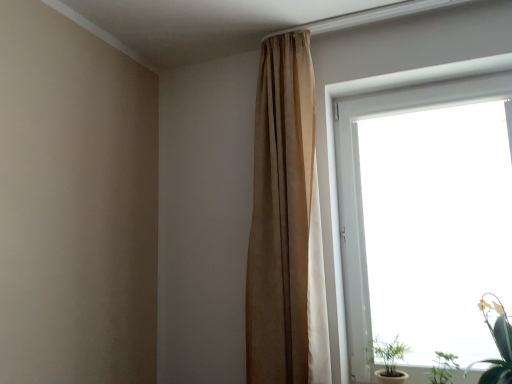
Question: Can you confirm if green leafy plant at lower right, the 2th houseplant when ordered from left to right, is bigger than green leafy plant at lower right, which is counted as the 3th houseplant, starting from the left?

Choices:
 (A) yes
 (B) no

Answer: (B)

Question: Is green leafy plant at lower right, the 2th houseplant when ordered from left to right, positioned far away from green leafy plant at lower right, which is counted as the 3th houseplant, starting from the left?

Choices:
 (A) no
 (B) yes

Answer: (A)

Question: Does green leafy plant at lower right, the 2th houseplant when ordered from left to right, have a lesser width compared to green leafy plant at lower right, which ranks as the first houseplant in right-to-left order?

Choices:
 (A) no
 (B) yes

Answer: (B)

Question: Is green leafy plant at lower right, the 2th houseplant when ordered from left to right, to the left of green leafy plant at lower right, which is counted as the 3th houseplant, starting from the left, from the viewer's perspective?

Choices:
 (A) no
 (B) yes

Answer: (B)

Question: Does green leafy plant at lower right, the 2th houseplant when ordered from left to right, have a lesser height compared to green leafy plant at lower right, which ranks as the first houseplant in right-to-left order?

Choices:
 (A) yes
 (B) no

Answer: (A)

Question: Based on their sizes in the image, would you say beige fabric curtain at upper center is bigger or smaller than green leafy plant at lower right, the 2th houseplant when ordered from left to right?

Choices:
 (A) small
 (B) big

Answer: (B)

Question: From their relative heights in the image, would you say beige fabric curtain at upper center is taller or shorter than green leafy plant at lower right, the 2th houseplant when ordered from left to right?

Choices:
 (A) short
 (B) tall

Answer: (B)

Question: From the image's perspective, is beige fabric curtain at upper center located above or below green leafy plant at lower right, which is the second houseplant from right to left?

Choices:
 (A) above
 (B) below

Answer: (A)

Question: Is beige fabric curtain at upper center wider or thinner than green leafy plant at lower right, which is the second houseplant from right to left?

Choices:
 (A) wide
 (B) thin

Answer: (B)

Question: Looking at the image, does green leafy plant at lower right, which is the second houseplant from right to left, seem bigger or smaller compared to green matte plant at lower right, which is counted as the 3th houseplant, starting from the right?

Choices:
 (A) small
 (B) big

Answer: (A)

Question: From a real-world perspective, is green leafy plant at lower right, which is the second houseplant from right to left, above or below green matte plant at lower right, arranged as the first houseplant when viewed from the left?

Choices:
 (A) above
 (B) below

Answer: (B)

Question: Is green leafy plant at lower right, which is the second houseplant from right to left, wider or thinner than green matte plant at lower right, arranged as the first houseplant when viewed from the left?

Choices:
 (A) thin
 (B) wide

Answer: (B)

Question: Relative to green matte plant at lower right, which is counted as the 3th houseplant, starting from the right, is green leafy plant at lower right, the 2th houseplant when ordered from left to right, in front or behind?

Choices:
 (A) behind
 (B) front

Answer: (B)

Question: In the image, is green matte plant at lower right, which is counted as the 3th houseplant, starting from the right, on the left side or the right side of transparent glass window at upper right?

Choices:
 (A) left
 (B) right

Answer: (A)

Question: In terms of width, does green matte plant at lower right, which is counted as the 3th houseplant, starting from the right, look wider or thinner when compared to transparent glass window at upper right?

Choices:
 (A) wide
 (B) thin

Answer: (A)